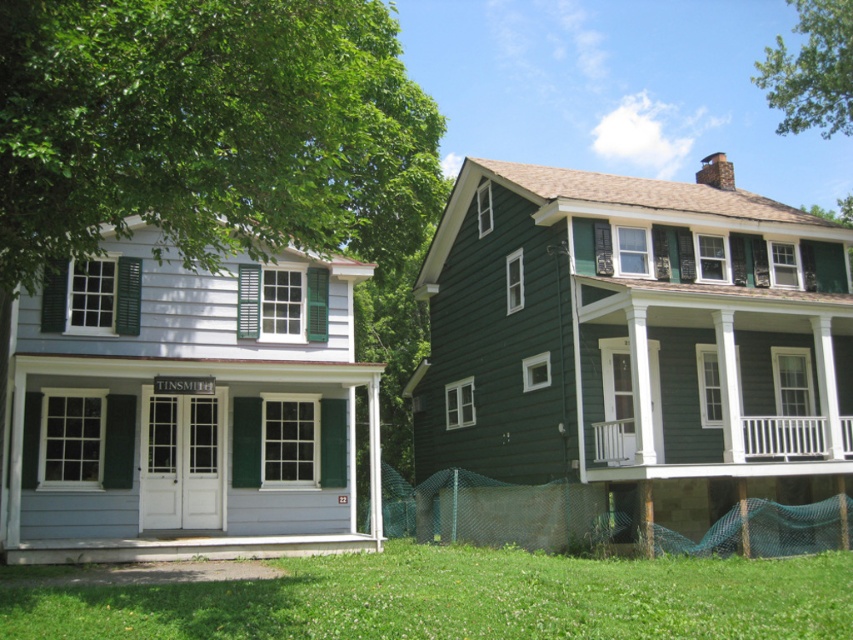
Is white painted wood porch at center above green painted wood shutter at center?

Actually, white painted wood porch at center is below green painted wood shutter at center.

Is white painted wood porch at center to the right of green painted wood shutter at center from the viewer's perspective?

Correct, you'll find white painted wood porch at center to the right of green painted wood shutter at center.

Locate an element on the screen. Image resolution: width=853 pixels, height=640 pixels. white painted wood porch at center is located at coordinates (756, 452).

At what (x,y) coordinates should I click in order to perform the action: click on white painted wood porch at center. Please return your answer as a coordinate pair (x, y). Looking at the image, I should click on (756, 452).

Who is positioned more to the right, green leafy tree at upper right or white painted wood porch at center?

From the viewer's perspective, green leafy tree at upper right appears more on the right side.

Measure the distance between point [807,72] and camera.

A distance of 108.54 feet exists between point [807,72] and camera.

Find the location of a particular element. Image resolution: width=853 pixels, height=640 pixels. green leafy tree at upper right is located at coordinates (811, 70).

Between green leafy tree at upper left and green leafy tree at upper right, which one is positioned higher?

Positioned higher is green leafy tree at upper right.

Is the position of green leafy tree at upper left more distant than that of green leafy tree at upper right?

No, green leafy tree at upper left is closer to the viewer.

Identify the location of green leafy tree at upper left. The image size is (853, 640). (209, 129).